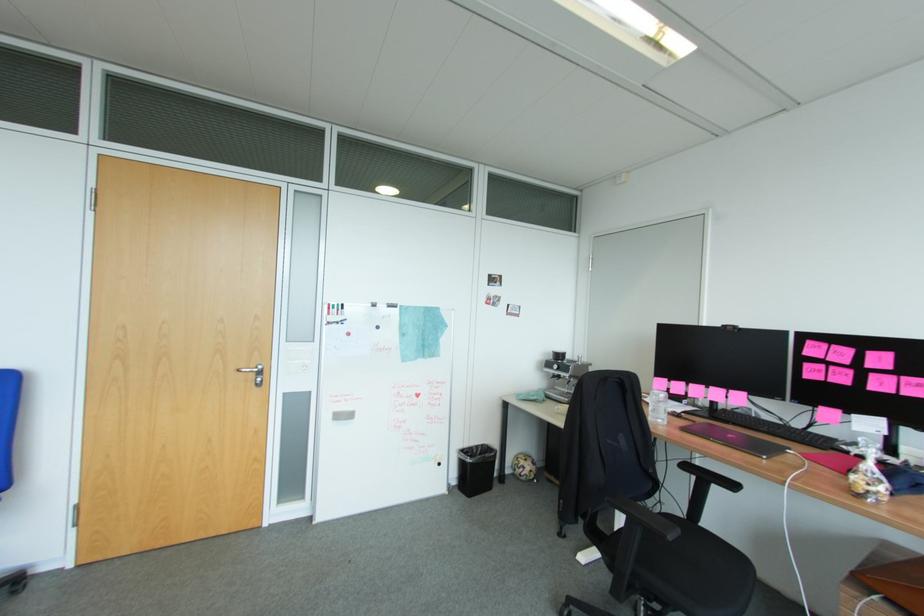
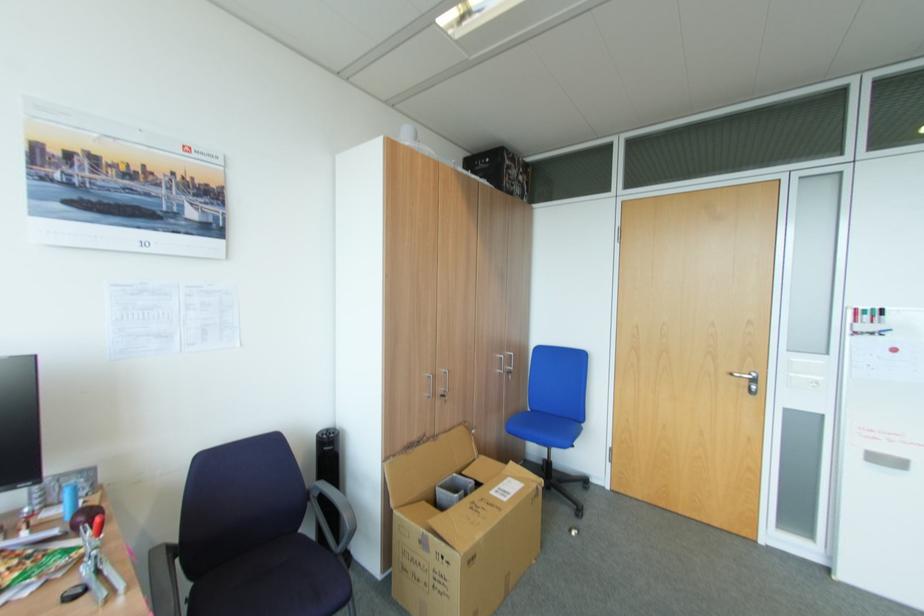
Question: The camera is either moving clockwise (left) or counter-clockwise (right) around the object. The first image is from the beginning of the video and the second image is from the end. Is the camera moving left or right when shooting the video?

Choices:
 (A) Left
 (B) Right

Answer: (B)